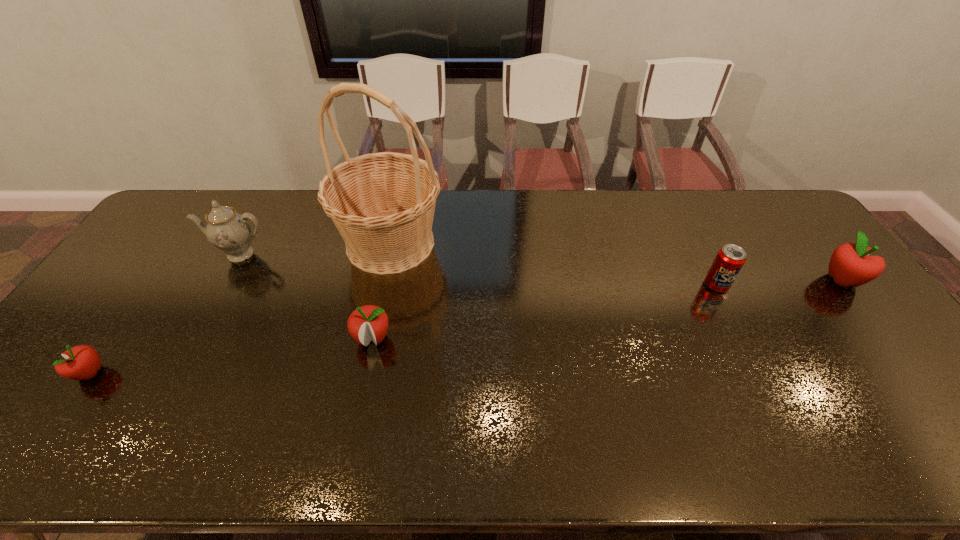
This screenshot has height=540, width=960. Identify the location of the nearest apple. (82, 362).

What are the coordinates of `the shortest apple` in the screenshot? It's located at (82, 362).

This screenshot has width=960, height=540. Identify the location of the second apple from right to left. (369, 322).

Identify the location of the second shortest apple. The image size is (960, 540). (369, 322).

Locate an element on the screen. This screenshot has width=960, height=540. the rightmost object is located at coordinates (850, 265).

Where is `the farthest apple`? the farthest apple is located at coordinates (850, 265).

Locate an element on the screen. Image resolution: width=960 pixels, height=540 pixels. basket is located at coordinates (383, 204).

Where is `chinaware`? Image resolution: width=960 pixels, height=540 pixels. chinaware is located at coordinates (230, 232).

Identify the location of the fifth shortest object. click(230, 232).

The width and height of the screenshot is (960, 540). Find the location of `soda can`. soda can is located at coordinates (729, 260).